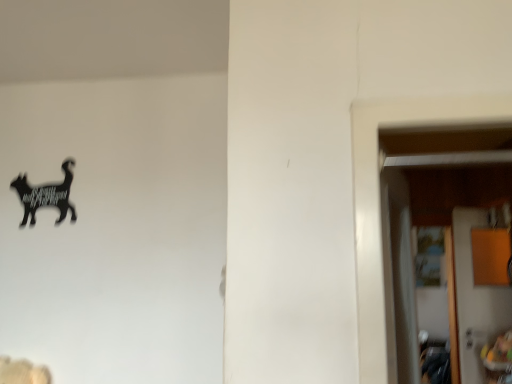
Find the location of a particular element. This screenshot has height=384, width=512. black matte cat at upper left is located at coordinates (46, 195).

The width and height of the screenshot is (512, 384). What do you see at coordinates (46, 195) in the screenshot? I see `black matte cat at upper left` at bounding box center [46, 195].

The height and width of the screenshot is (384, 512). Describe the element at coordinates (475, 299) in the screenshot. I see `wooden door at right` at that location.

Image resolution: width=512 pixels, height=384 pixels. In order to click on wooden door at right in this screenshot , I will do (x=475, y=299).

Where is `black matte cat at upper left`? The height and width of the screenshot is (384, 512). black matte cat at upper left is located at coordinates (46, 195).

Can you confirm if wooden door at right is positioned to the right of black matte cat at upper left?

Yes.

Consider the image. Does wooden door at right lie in front of black matte cat at upper left?

No, it is behind black matte cat at upper left.

Which point is more distant from viewer, (x=466, y=319) or (x=70, y=186)?

The point (x=466, y=319) is farther from the camera.

In the scene shown: From the image's perspective, is wooden door at right on black matte cat at upper left?

Incorrect, from the image's perspective, wooden door at right is lower than black matte cat at upper left.

In the scene shown: From a real-world perspective, is wooden door at right on black matte cat at upper left?

Actually, wooden door at right is physically below black matte cat at upper left in the real world.

Considering the sizes of objects wooden door at right and black matte cat at upper left in the image provided, who is thinner, wooden door at right or black matte cat at upper left?

With smaller width is black matte cat at upper left.

Based on the photo, which of these two, wooden door at right or black matte cat at upper left, stands shorter?

Standing shorter between the two is black matte cat at upper left.

Considering the relative sizes of wooden door at right and black matte cat at upper left in the image provided, is wooden door at right bigger than black matte cat at upper left?

Yes.

In the scene shown: Is wooden door at right located outside black matte cat at upper left?

Yes.

Is wooden door at right with black matte cat at upper left?

No.

Is black matte cat at upper left at the back of wooden door at right?

No, wooden door at right's orientation is not away from black matte cat at upper left.

How different are the orientations of wooden door at right and black matte cat at upper left in degrees?

145 degrees separate the facing orientations of wooden door at right and black matte cat at upper left.

You are a GUI agent. You are given a task and a screenshot of the screen. Output one action in this format:
    pyautogui.click(x=<x>, y=<y>)
    Task: Click on the door on the right side of black matte cat at upper left
    
    Given the screenshot: What is the action you would take?
    pyautogui.click(x=475, y=299)

Which is more to the left, black matte cat at upper left or wooden door at right?

From the viewer's perspective, black matte cat at upper left appears more on the left side.

Is the position of black matte cat at upper left less distant than that of wooden door at right?

Yes, it is.

Which is nearer, (37, 194) or (485, 299)?

Point (37, 194).

From the image's perspective, who appears lower, black matte cat at upper left or wooden door at right?

wooden door at right.

Looking at this image, from a real-world perspective, is black matte cat at upper left above or below wooden door at right?

black matte cat at upper left is situated higher than wooden door at right in the real world.

Looking at their sizes, would you say black matte cat at upper left is wider or thinner than wooden door at right?

Clearly, black matte cat at upper left has less width compared to wooden door at right.

Can you confirm if black matte cat at upper left is shorter than wooden door at right?

Yes.

Consider the image. Which of these two, black matte cat at upper left or wooden door at right, is smaller?

black matte cat at upper left is smaller.

Is black matte cat at upper left not inside wooden door at right?

Yes.

Is black matte cat at upper left far from wooden door at right?

black matte cat at upper left is positioned a significant distance from wooden door at right.

Could you tell me if black matte cat at upper left is facing wooden door at right?

No.

Consider the image. How different are the orientations of black matte cat at upper left and wooden door at right in degrees?

They differ by 145 degrees in their facing directions.

I want to click on door located behind the black matte cat at upper left, so click(x=475, y=299).

Locate an element on the screen. The image size is (512, 384). door below the black matte cat at upper left (from a real-world perspective) is located at coordinates (475, 299).

Identify the location of door lying on the right of black matte cat at upper left. The height and width of the screenshot is (384, 512). (475, 299).